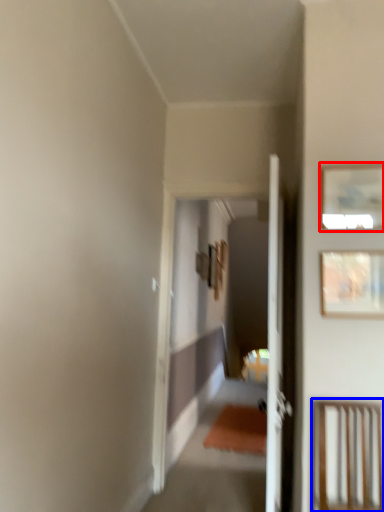
Question: Which point is closer to the camera, picture frame (highlighted by a red box) or furniture (highlighted by a blue box)?

Choices:
 (A) picture frame
 (B) furniture

Answer: (B)